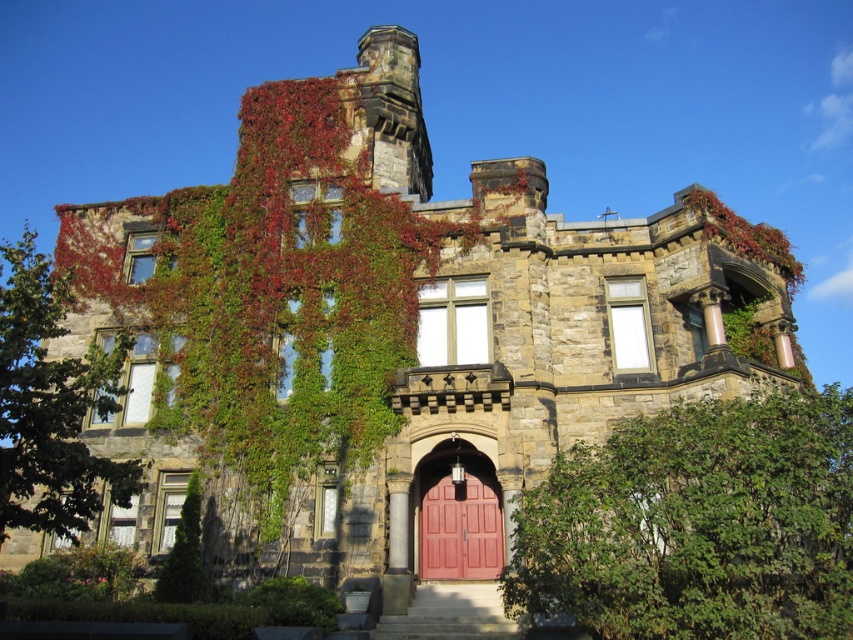
Who is more forward, (817, 449) or (422, 513)?

Point (817, 449)

The image size is (853, 640). Describe the element at coordinates (697, 524) in the screenshot. I see `green leafy ivy at right` at that location.

Is point (590, 593) positioned in front of point (492, 547)?

Yes, point (590, 593) is in front of point (492, 547).

Identify the location of green leafy ivy at right. (697, 524).